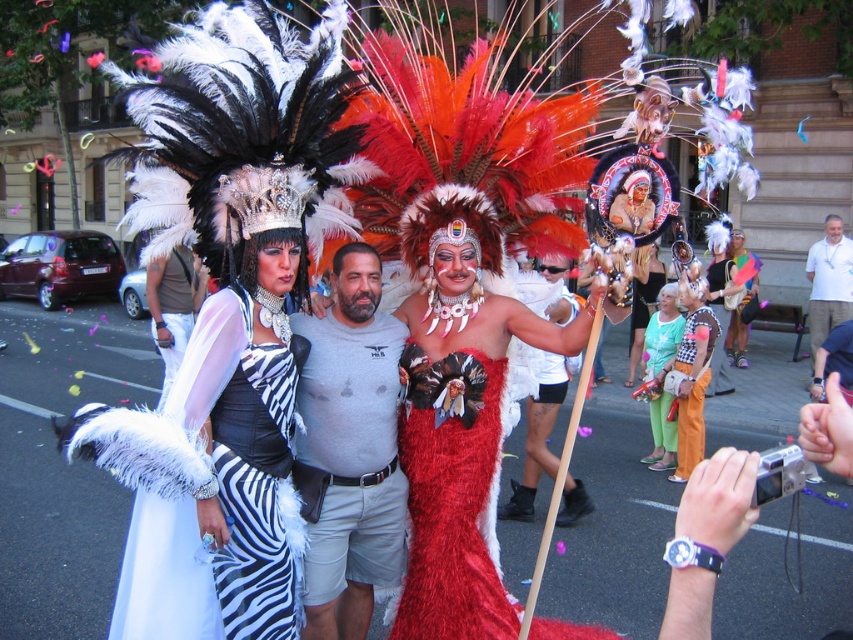
Question: Does gray cotton shirt at center have a smaller size compared to velvet orange dress at center?

Choices:
 (A) yes
 (B) no

Answer: (B)

Question: Among these objects, which one is farthest from the camera?

Choices:
 (A) gray cotton shirt at center
 (B) zebra print fabric dress at left

Answer: (A)

Question: Which of the following is the closest to the observer?

Choices:
 (A) fuzzy red dress at center
 (B) white cotton shirt at center

Answer: (A)

Question: Can you confirm if fuzzy red dress at center is positioned to the right of white feathered headdress at center?

Choices:
 (A) no
 (B) yes

Answer: (A)

Question: Which point is farther to the camera?

Choices:
 (A) (183, 381)
 (B) (550, 467)

Answer: (B)

Question: From the image, what is the correct spatial relationship of white feathered headdress at center in relation to velvet orange dress at center?

Choices:
 (A) right
 (B) left

Answer: (B)